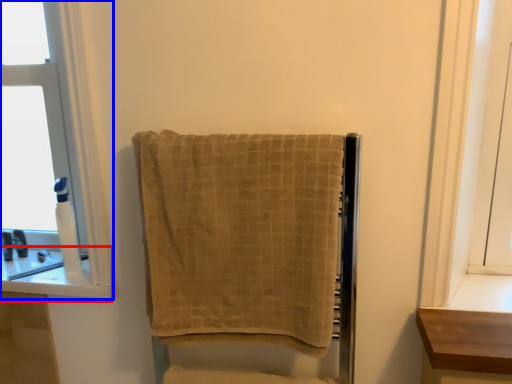
Question: Among these objects, which one is farthest to the camera, window sill (highlighted by a red box) or window (highlighted by a blue box)?

Choices:
 (A) window sill
 (B) window

Answer: (B)